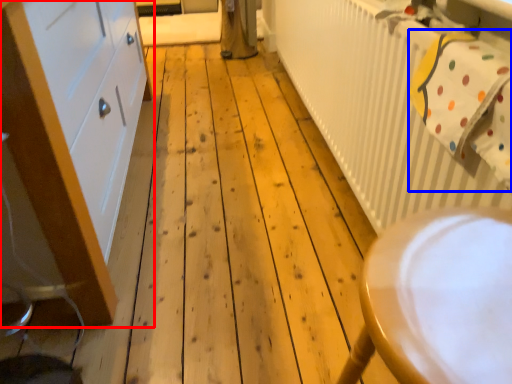
Question: Among these objects, which one is farthest to the camera, cabinetry (highlighted by a red box) or laundry (highlighted by a blue box)?

Choices:
 (A) cabinetry
 (B) laundry

Answer: (B)